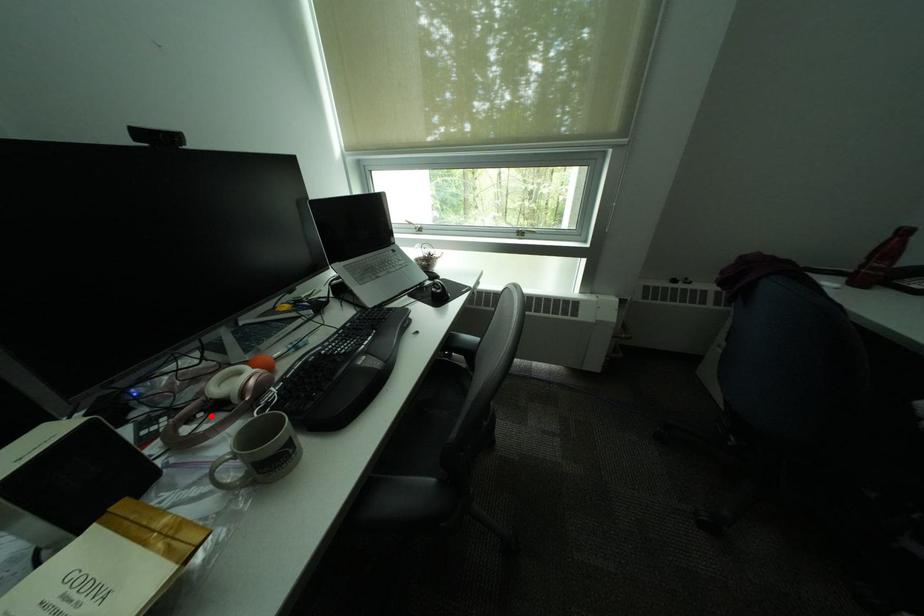
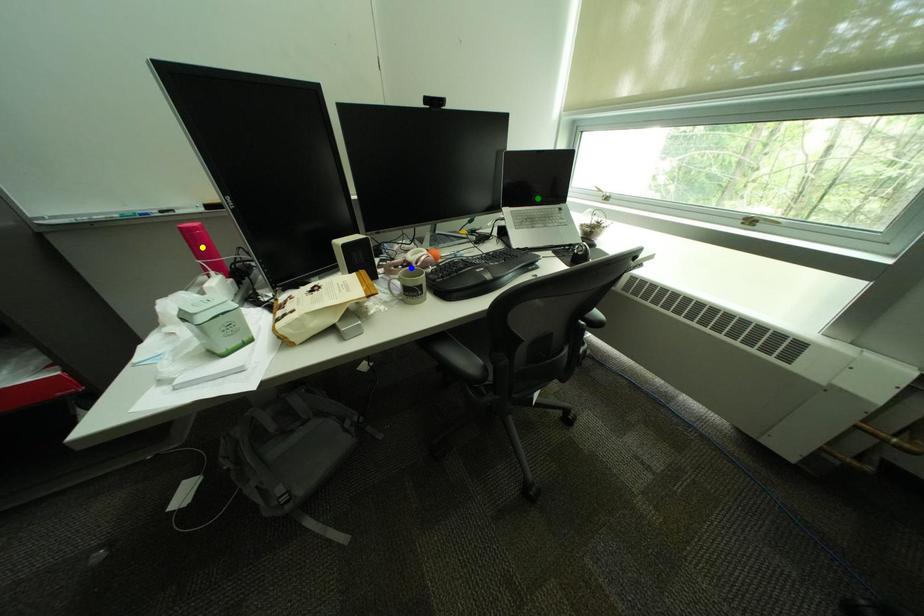
Question: I am providing you with two images of the same scene from different viewpoints. A red point is marked on the first image. You are given multiple points on the second image. In image 2, which mark is for the same physical point as the one in image 1?

Choices:
 (A) yellow point
 (B) green point
 (C) blue point

Answer: (C)